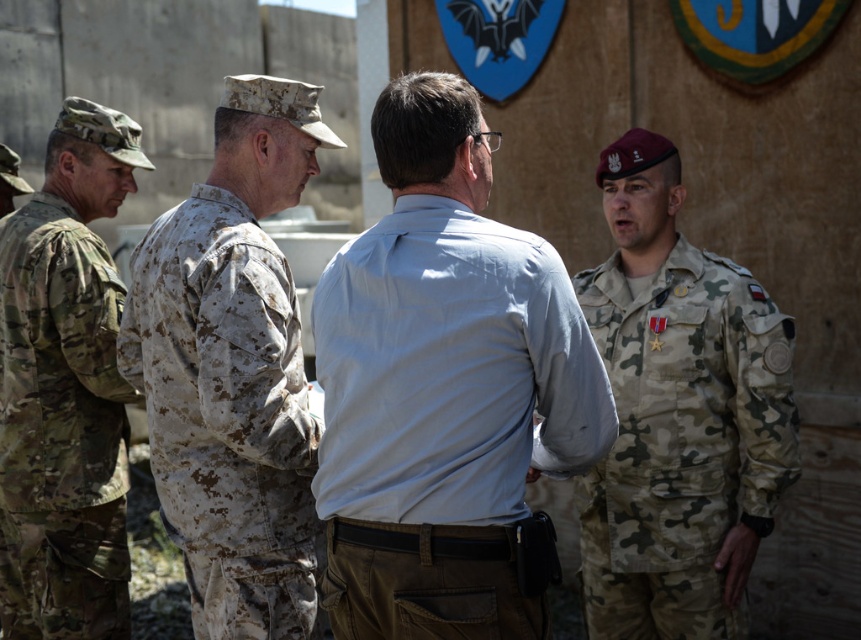
Question: Is light blue cotton shirt at center above camouflage uniform at left?

Choices:
 (A) no
 (B) yes

Answer: (B)

Question: Estimate the real-world distances between objects in this image. Which object is closer to the camouflage uniform at left?

Choices:
 (A) light blue cotton shirt at center
 (B) camouflage uniform at center

Answer: (B)

Question: Does light blue cotton shirt at center appear on the right side of camouflage uniform at left?

Choices:
 (A) no
 (B) yes

Answer: (B)

Question: Among these objects, which one is nearest to the camera?

Choices:
 (A) light blue cotton shirt at center
 (B) camouflage uniform at center
 (C) camouflage uniform at left

Answer: (A)

Question: Can you confirm if camouflage uniform at right is positioned to the left of camouflage uniform at left?

Choices:
 (A) yes
 (B) no

Answer: (B)

Question: Which object appears farthest from the camera in this image?

Choices:
 (A) light blue cotton shirt at center
 (B) camouflage uniform at right
 (C) camouflage uniform at center

Answer: (B)